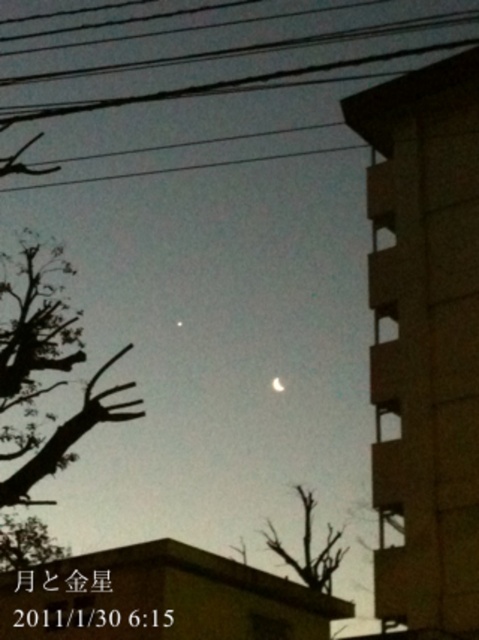
Based on the photo, is black wire at upper center further to camera compared to bright silver moon at center?

No, black wire at upper center is closer to the viewer.

Who is taller, black wire at upper center or bright silver moon at center?

black wire at upper center is taller.

Who is more forward, [7,84] or [274,381]?

Positioned in front is point [7,84].

Where is `black wire at upper center`? The image size is (479, 640). black wire at upper center is located at coordinates (255, 48).